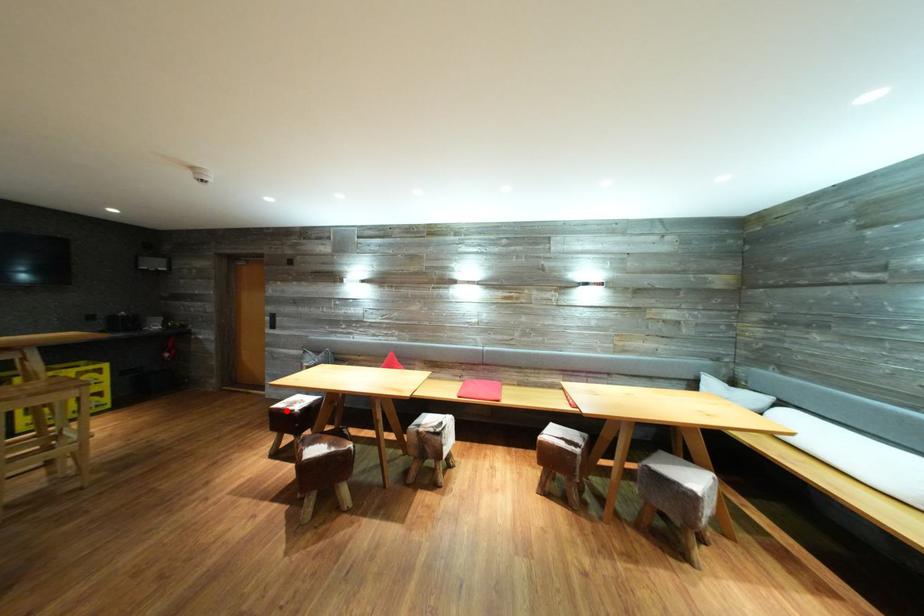
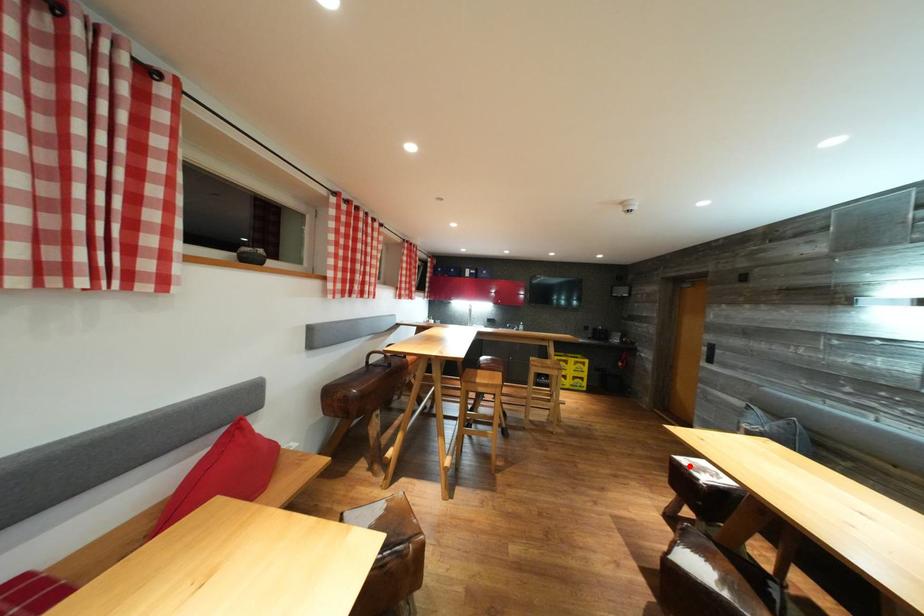
Based on the photo, I am providing you with two images of the same scene from different viewpoints. A red point is marked on the first image and another point is marked on the second image. Are the points marked in image1 and image2 representing the same 3D position?

Yes